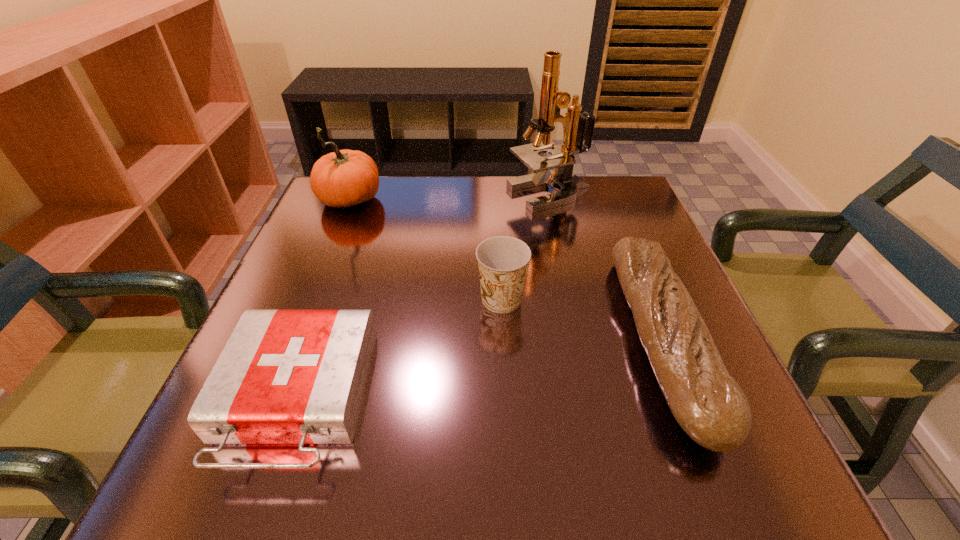
Locate an element on the screen. vacant space that is in between the first-aid kit and the pumpkin is located at coordinates [323, 300].

Where is `vacant space that is in between the baguet and the microscope`? vacant space that is in between the baguet and the microscope is located at coordinates (606, 266).

Identify the location of empty location between the pumpkin and the third tallest object. click(x=425, y=251).

You are a GUI agent. You are given a task and a screenshot of the screen. Output one action in this format:
    pyautogui.click(x=<x>, y=<y>)
    Task: Click on the object that is the second closest one to the second shortest object
    The image size is (960, 540).
    Given the screenshot: What is the action you would take?
    pyautogui.click(x=502, y=260)

Locate which object ranks third in proximity to the shortest object. Please provide its 2D coordinates. Your answer should be formatted as a tuple, i.e. [(x, y)], where the tuple contains the x and y coordinates of a point satisfying the conditions above.

[(709, 405)]

Where is `free space that satisfies the following two spatial constraints: 1. on the front side of the third shortest object; 2. on the right side of the second shortest object`? free space that satisfies the following two spatial constraints: 1. on the front side of the third shortest object; 2. on the right side of the second shortest object is located at coordinates (503, 338).